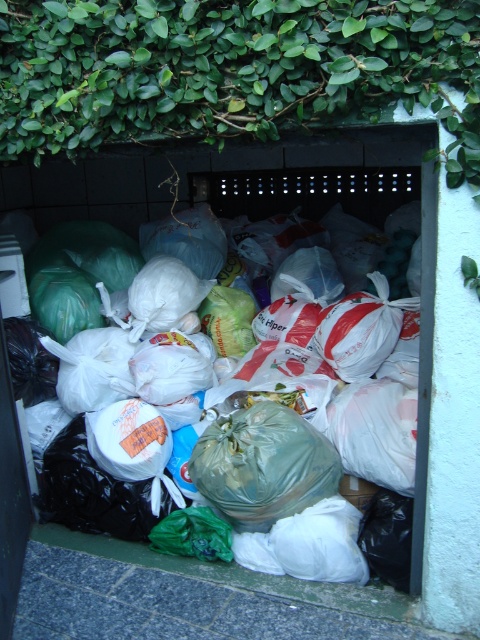
Question: Observing the image, what is the correct spatial positioning of gray concrete pavement at lower left in reference to translucent plastic bags at center?

Choices:
 (A) left
 (B) right

Answer: (A)

Question: Is gray concrete pavement at lower left positioned before translucent plastic bags at center?

Choices:
 (A) no
 (B) yes

Answer: (B)

Question: Among these objects, which one is farthest from the camera?

Choices:
 (A) translucent plastic bags at center
 (B) gray concrete pavement at lower left

Answer: (A)

Question: Which point is farther to the camera?

Choices:
 (A) (412, 234)
 (B) (172, 593)

Answer: (A)

Question: Does gray concrete pavement at lower left lie in front of translucent plastic bags at center?

Choices:
 (A) no
 (B) yes

Answer: (B)